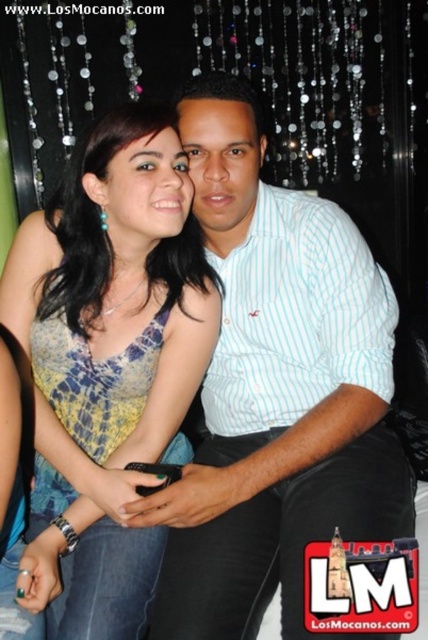
Can you confirm if white striped shirt at center is bigger than printed fabric dress at center?

Yes, white striped shirt at center is bigger than printed fabric dress at center.

Does white striped shirt at center have a smaller size compared to printed fabric dress at center?

No, white striped shirt at center is not smaller than printed fabric dress at center.

Where is `white striped shirt at center`? The image size is (428, 640). white striped shirt at center is located at coordinates (276, 392).